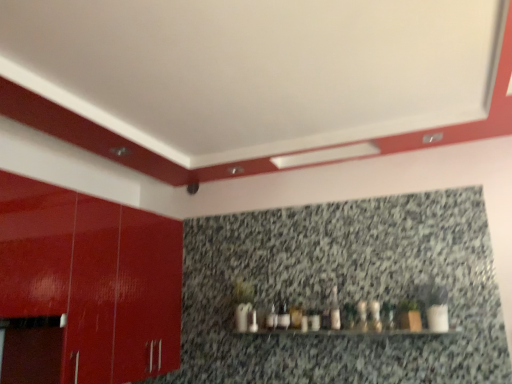
The image size is (512, 384). Find the location of `free space above granite at upper center (from a real-world perspective)`. free space above granite at upper center (from a real-world perspective) is located at coordinates pos(314,205).